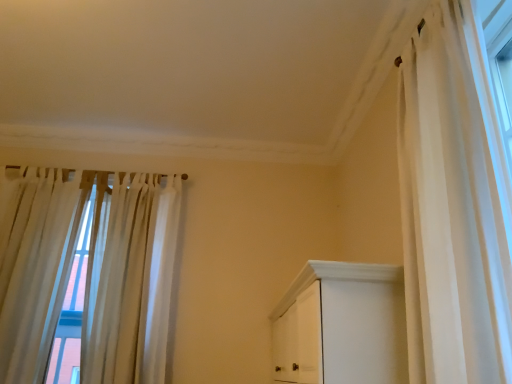
Question: Does white sheer curtain at left, the third curtain positioned from the right, have a smaller size compared to white sheer curtain at right, the 3th curtain viewed from the back?

Choices:
 (A) yes
 (B) no

Answer: (B)

Question: Can you confirm if white sheer curtain at left, the third curtain positioned from the right, is taller than white sheer curtain at right, the 1th curtain in the right-to-left sequence?

Choices:
 (A) no
 (B) yes

Answer: (B)

Question: Considering the relative positions of white sheer curtain at left, which ranks as the 1th curtain in left-to-right order, and white sheer curtain at right, the 1th curtain in the right-to-left sequence, in the image provided, is white sheer curtain at left, which ranks as the 1th curtain in left-to-right order, to the right of white sheer curtain at right, the 1th curtain in the right-to-left sequence, from the viewer's perspective?

Choices:
 (A) yes
 (B) no

Answer: (B)

Question: Is white sheer curtain at left, the second curtain viewed from the back, further to the viewer compared to white sheer curtain at right, the 3th curtain viewed from the back?

Choices:
 (A) yes
 (B) no

Answer: (A)

Question: Is white sheer curtain at left, the second curtain viewed from the back, in contact with white sheer curtain at right, which is counted as the third curtain, starting from the left?

Choices:
 (A) no
 (B) yes

Answer: (A)

Question: Can you confirm if white sheer curtain at left, the third curtain positioned from the right, is positioned to the left of white sheer curtain at right, the 1th curtain in the right-to-left sequence?

Choices:
 (A) no
 (B) yes

Answer: (B)

Question: From a real-world perspective, is white sheer curtain at right, which is the 1th curtain from front to back, located higher than sheer white curtains at left, positioned as the 2th curtain in right-to-left order?

Choices:
 (A) yes
 (B) no

Answer: (A)

Question: Is white sheer curtain at right, which is the 1th curtain from front to back, taller than sheer white curtains at left, positioned as the 2th curtain in right-to-left order?

Choices:
 (A) yes
 (B) no

Answer: (B)

Question: Is white sheer curtain at right, the 1th curtain in the right-to-left sequence, touching sheer white curtains at left, positioned as the 2th curtain in right-to-left order?

Choices:
 (A) no
 (B) yes

Answer: (A)

Question: Is white sheer curtain at right, the 3th curtain viewed from the back, completely or partially outside of sheer white curtains at left, acting as the 1th curtain starting from the back?

Choices:
 (A) yes
 (B) no

Answer: (A)

Question: Is white sheer curtain at right, the 1th curtain in the right-to-left sequence, thinner than sheer white curtains at left, acting as the second curtain starting from the left?

Choices:
 (A) no
 (B) yes

Answer: (A)

Question: Would you say white sheer curtain at right, which is counted as the third curtain, starting from the left, is a long distance from sheer white curtains at left, acting as the second curtain starting from the left?

Choices:
 (A) no
 (B) yes

Answer: (B)

Question: Can you confirm if white sheer curtain at right, the 3th curtain viewed from the back, is wider than white sheer curtain at left, which ranks as the 1th curtain in left-to-right order?

Choices:
 (A) no
 (B) yes

Answer: (B)